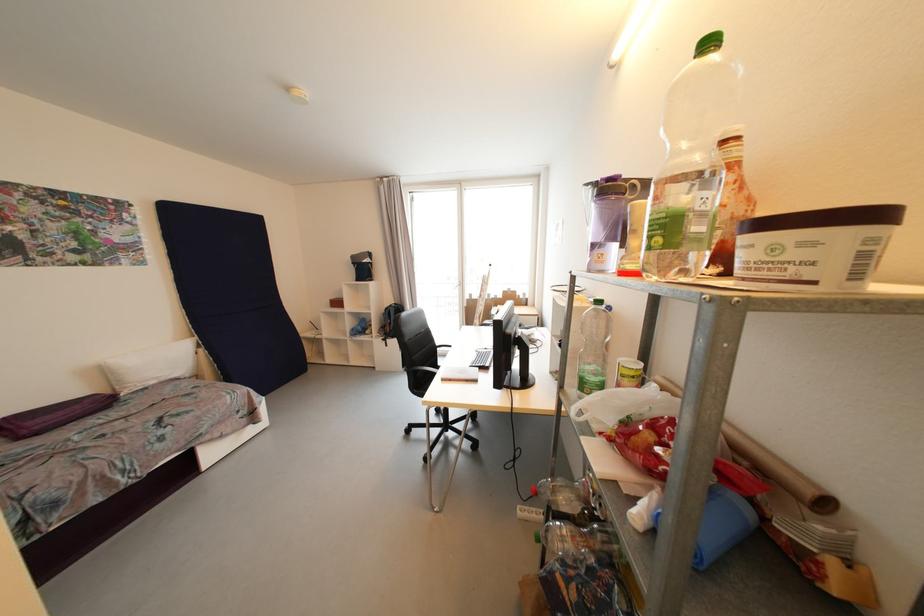
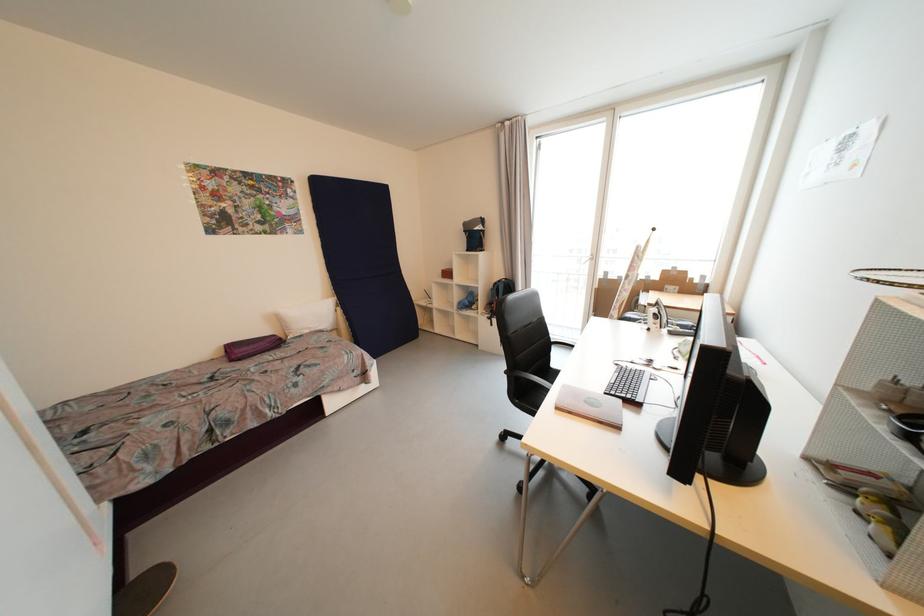
Question: The images are taken continuously from a first-person perspective. In which direction is your viewpoint rotating?

Choices:
 (A) Left
 (B) Right
 (C) Up
 (D) Down

Answer: (A)